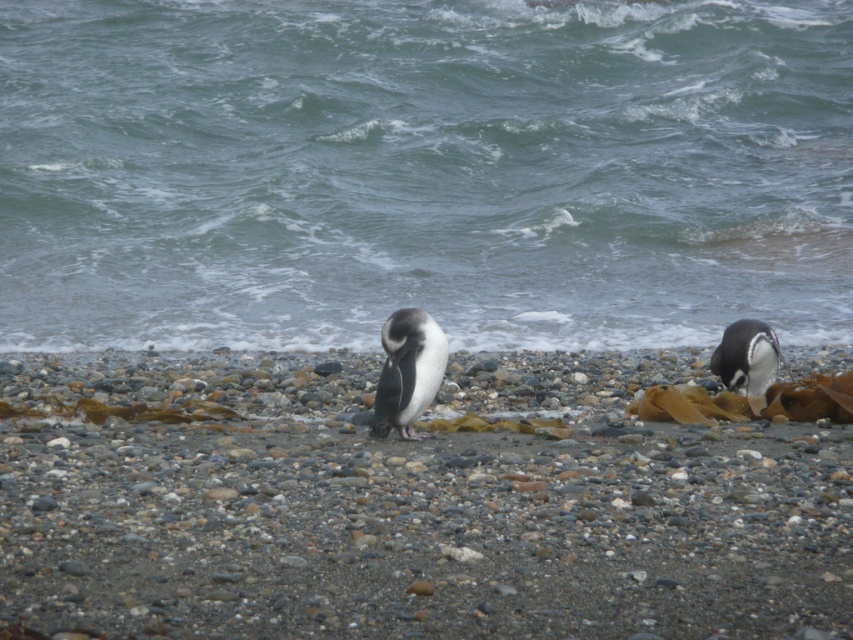
Can you confirm if smooth pebble at center is smaller than black and white feathers at center?

No.

Between smooth pebble at center and black and white feathers at center, which one appears on the right side from the viewer's perspective?

From the viewer's perspective, smooth pebble at center appears more on the right side.

Locate an element on the screen. smooth pebble at center is located at coordinates (410, 504).

Identify the location of smooth pebble at center. Image resolution: width=853 pixels, height=640 pixels. (410, 504).

Looking at this image, between greenish-blue water at center and smooth pebble at center, which one is positioned higher?

Positioned higher is greenish-blue water at center.

Does greenish-blue water at center come behind smooth pebble at center?

Yes, it is behind smooth pebble at center.

This screenshot has height=640, width=853. Identify the location of greenish-blue water at center. (422, 172).

Which is above, black and white feathers at center or white glossy penguin at right?

white glossy penguin at right is above.

Locate an element on the screen. black and white feathers at center is located at coordinates (407, 371).